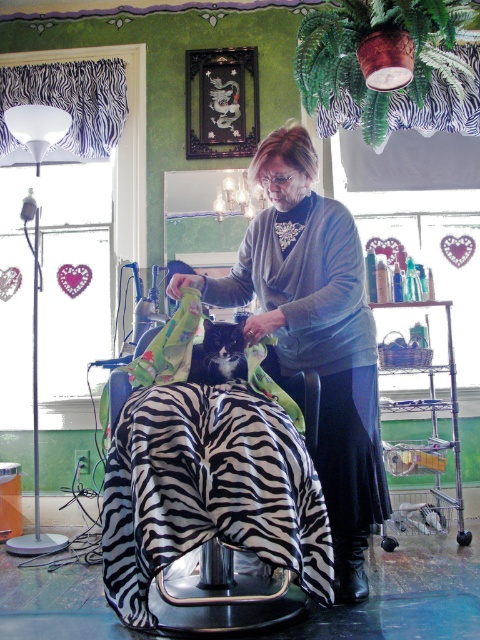
Question: Does matte gray sweater at center appear over black fur cat at center?

Choices:
 (A) no
 (B) yes

Answer: (A)

Question: Is matte gray sweater at center thinner than black fur cat at center?

Choices:
 (A) no
 (B) yes

Answer: (A)

Question: Can you confirm if matte gray sweater at center is smaller than black fur cat at center?

Choices:
 (A) no
 (B) yes

Answer: (A)

Question: Among these objects, which one is farthest from the camera?

Choices:
 (A) black fur cat at center
 (B) matte gray sweater at center

Answer: (B)